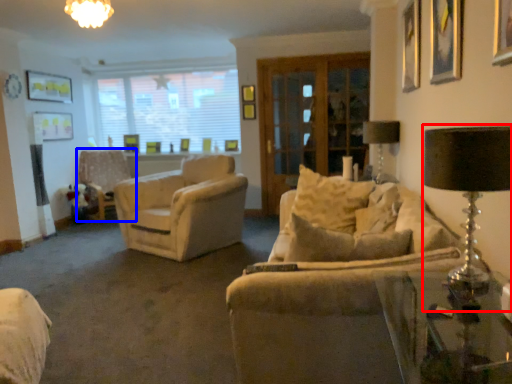
Question: Which object appears farthest to the camera in this image, table lamp (highlighted by a red box) or chair (highlighted by a blue box)?

Choices:
 (A) table lamp
 (B) chair

Answer: (B)